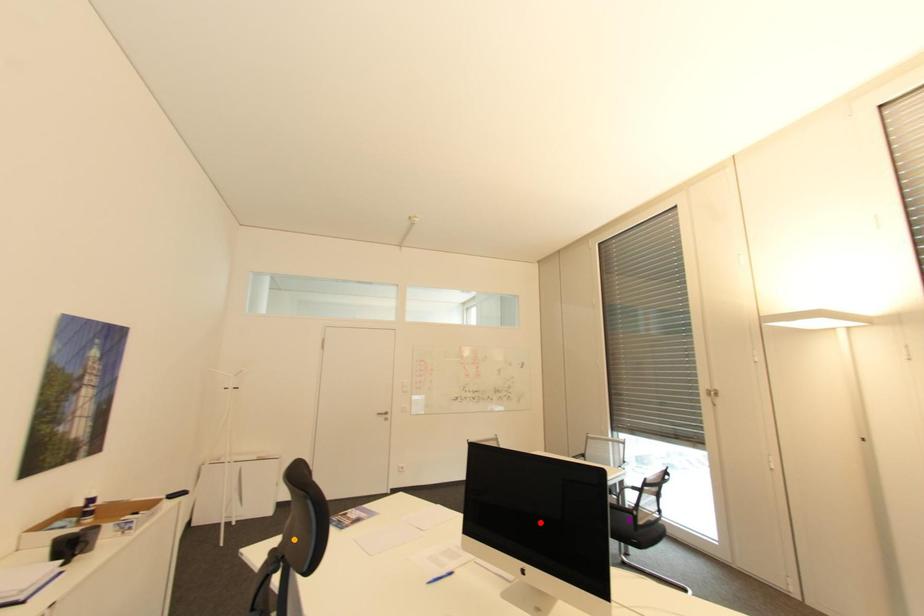
Order these from nearest to farthest:
purple point
orange point
red point

red point
purple point
orange point